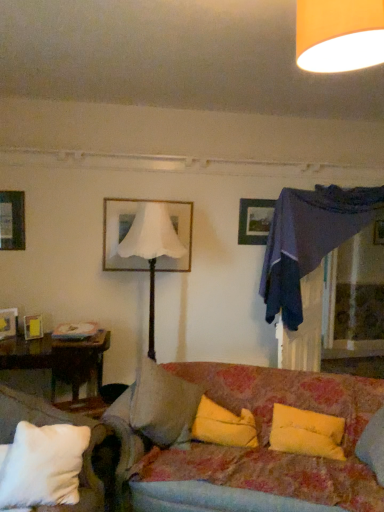
Question: Considering the relative positions of white soft pillow at lower left, positioned as the first pillow in left-to-right order, and wooden picture frame at lower left, acting as the third picture frame starting from the left, in the image provided, is white soft pillow at lower left, positioned as the first pillow in left-to-right order, behind wooden picture frame at lower left, acting as the third picture frame starting from the left,?

Choices:
 (A) no
 (B) yes

Answer: (A)

Question: Is white soft pillow at lower left, the 3th pillow from the right, to the left of wooden picture frame at lower left, marked as the second picture frame in a right-to-left arrangement, from the viewer's perspective?

Choices:
 (A) yes
 (B) no

Answer: (B)

Question: Is white soft pillow at lower left, positioned as the first pillow in left-to-right order, next to wooden picture frame at lower left, marked as the second picture frame in a right-to-left arrangement?

Choices:
 (A) yes
 (B) no

Answer: (B)

Question: Can you confirm if white soft pillow at lower left, positioned as the first pillow in left-to-right order, is thinner than wooden picture frame at lower left, marked as the second picture frame in a right-to-left arrangement?

Choices:
 (A) no
 (B) yes

Answer: (A)

Question: From a real-world perspective, is white soft pillow at lower left, positioned as the first pillow in left-to-right order, located beneath wooden picture frame at lower left, acting as the third picture frame starting from the left?

Choices:
 (A) no
 (B) yes

Answer: (B)

Question: Are white soft pillow at lower left, the 3th pillow from the right, and wooden picture frame at lower left, marked as the second picture frame in a right-to-left arrangement, located far from each other?

Choices:
 (A) no
 (B) yes

Answer: (B)

Question: From a real-world perspective, is wooden picture frame at left, which is the 4th picture frame in right-to-left order, located beneath transparent glass door at upper right?

Choices:
 (A) yes
 (B) no

Answer: (A)

Question: Is wooden picture frame at left, which is the 4th picture frame in right-to-left order, with transparent glass door at upper right?

Choices:
 (A) yes
 (B) no

Answer: (B)

Question: Is wooden picture frame at left, which appears as the first picture frame when viewed from the left, not near transparent glass door at upper right?

Choices:
 (A) yes
 (B) no

Answer: (A)

Question: Does wooden picture frame at left, which appears as the first picture frame when viewed from the left, have a smaller size compared to transparent glass door at upper right?

Choices:
 (A) yes
 (B) no

Answer: (A)

Question: Is wooden picture frame at left, which is the 4th picture frame in right-to-left order, wider than transparent glass door at upper right?

Choices:
 (A) yes
 (B) no

Answer: (B)

Question: Is wooden picture frame at left, which appears as the first picture frame when viewed from the left, facing towards transparent glass door at upper right?

Choices:
 (A) no
 (B) yes

Answer: (A)

Question: Is the surface of orange fabric lampshade at upper center, which ranks as the first lamp in front-to-back order, in direct contact with floral fabric couch at center?

Choices:
 (A) yes
 (B) no

Answer: (B)